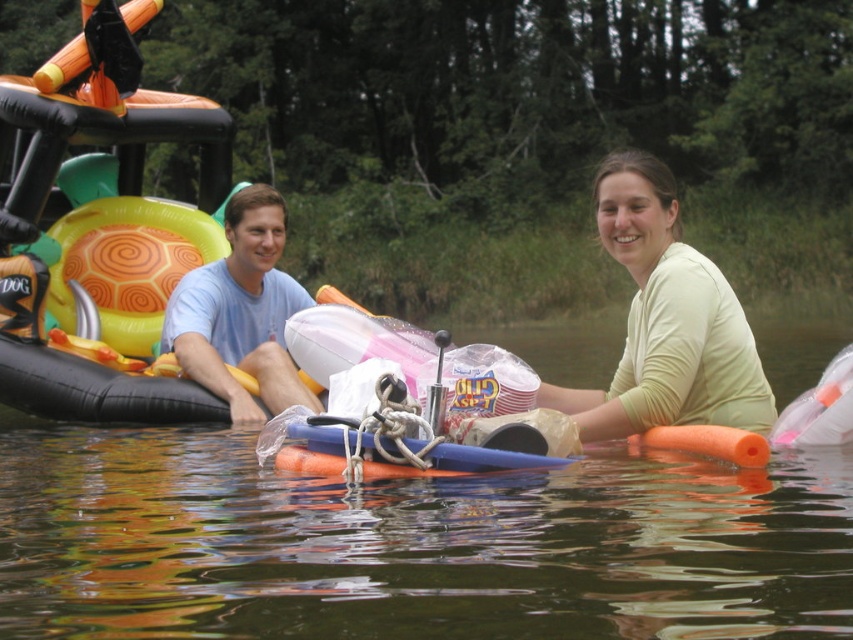
Between point (703, 346) and point (215, 371), which one is positioned behind?

The point (215, 371) is more distant.

Consider the image. Can you confirm if light yellow fabric at center is taller than light blue cotton shirt at center?

Incorrect, light yellow fabric at center's height is not larger of light blue cotton shirt at center's.

Who is more forward, (714, 304) or (274, 193)?

Point (714, 304) is in front.

Find the location of a particular element. light yellow fabric at center is located at coordinates (665, 321).